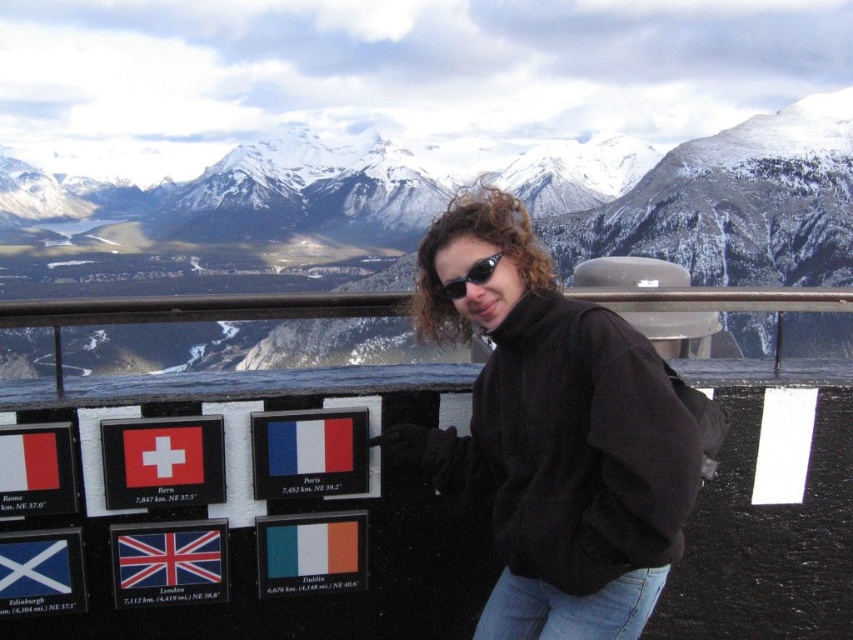
Question: Does black fleece jacket at center appear under blue fabric flag at lower left?

Choices:
 (A) yes
 (B) no

Answer: (B)

Question: Which of the following is the closest to the observer?

Choices:
 (A) white fabric flag at center
 (B) matte red flag at lower left

Answer: (B)

Question: Can you confirm if green matte flag at lower center is bigger than matte plastic flag at center?

Choices:
 (A) no
 (B) yes

Answer: (B)

Question: Among these objects, which one is nearest to the camera?

Choices:
 (A) tricolor fabric flag at center
 (B) white fabric flag at center

Answer: (B)

Question: Which object is farther from the camera taking this photo?

Choices:
 (A) tricolor fabric flag at center
 (B) blue fabric flag at lower left
 (C) matte plastic flag at center
 (D) matte red flag at lower left

Answer: (A)

Question: Can you confirm if green matte flag at lower center is positioned to the left of blue fabric flag at lower left?

Choices:
 (A) yes
 (B) no

Answer: (B)